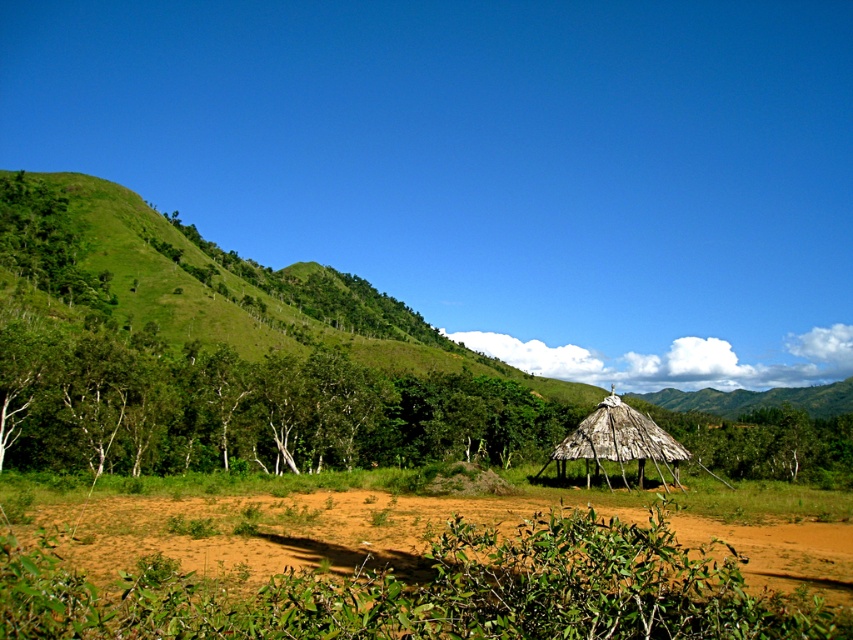
Question: Which object is positioned farthest from the brown sandy soil at lower center?

Choices:
 (A) natural thatch hut at center
 (B) green leafy trees at left

Answer: (B)

Question: Which of the following is the farthest from the observer?

Choices:
 (A) green leafy trees at left
 (B) brown sandy soil at lower center

Answer: (A)

Question: Considering the relative positions of green leafy trees at left and natural thatch hut at center in the image provided, where is green leafy trees at left located with respect to natural thatch hut at center?

Choices:
 (A) right
 (B) left

Answer: (B)

Question: Can you confirm if green leafy trees at left is smaller than natural thatch hut at center?

Choices:
 (A) no
 (B) yes

Answer: (A)

Question: Where is green leafy trees at left located in relation to natural thatch hut at center in the image?

Choices:
 (A) left
 (B) right

Answer: (A)

Question: Among these objects, which one is farthest from the camera?

Choices:
 (A) natural thatch hut at center
 (B) brown sandy soil at lower center
 (C) green leafy trees at left

Answer: (C)